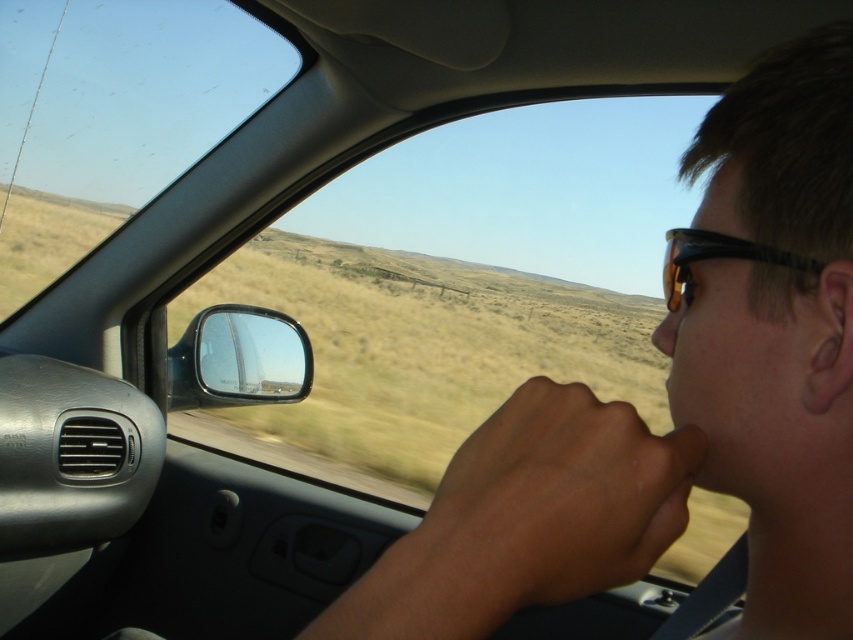
Question: Estimate the real-world distances between objects in this image. Which object is farther from the matte orange nose at center?

Choices:
 (A) tortoiseshell plastic goggles at right
 (B) transparent glass window at upper left

Answer: (B)

Question: Does transparent glass window at upper left appear on the left side of glossy plastic side mirror at lower left?

Choices:
 (A) yes
 (B) no

Answer: (A)

Question: Which object appears farthest from the camera in this image?

Choices:
 (A) glossy plastic side mirror at lower left
 (B) tortoiseshell plastic goggles at right

Answer: (A)

Question: Does light skin tone flesh at center appear over tortoiseshell plastic goggles at right?

Choices:
 (A) yes
 (B) no

Answer: (B)

Question: Is tortoiseshell plastic goggles at right in front of matte orange nose at center?

Choices:
 (A) no
 (B) yes

Answer: (B)

Question: Which of these objects is positioned farthest from the light skin tone flesh at center?

Choices:
 (A) glossy plastic side mirror at lower left
 (B) transparent glass window at upper left
 (C) matte orange nose at center
 (D) tortoiseshell plastic goggles at right

Answer: (B)